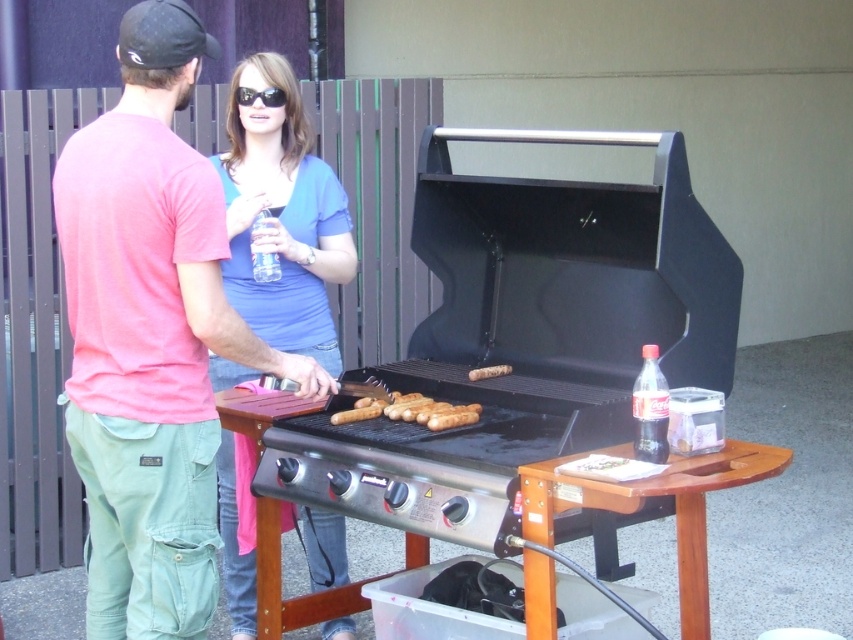
You are a guest at this barbecue and want to ask the woman in the blue cotton shirt at upper center for a drink. Where should you look to find her in relation to the brown matte hot dog at center?

The blue cotton shirt at upper center is above the brown matte hot dog at center, so you should look upwards from the hot dog to find her.